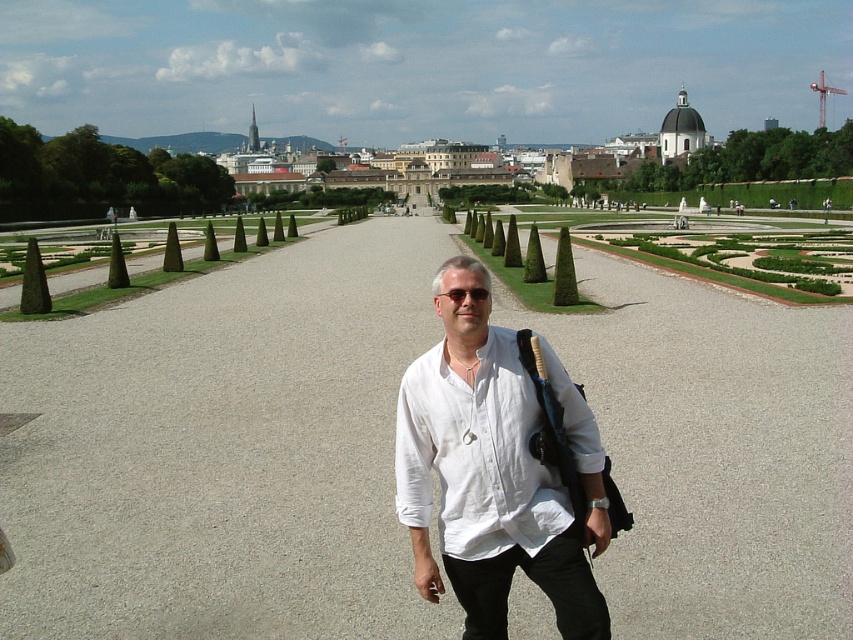
You are a tourist holding the black plastic sunglasses at center and want to walk along the gray gravel path at center. Since both are at the center, which one is closer to you?

The black plastic sunglasses at center are closer to you than the gray gravel path at center because the sunglasses are an object you are holding, while the path is the surface you are standing on.

You are standing at the entrance of the plaza and see two points marked in the image. The first point is at coordinates point (500, 445) and the second is at point (666, 122). If you want to reach the point that is closer to the grand building in the background, which coordinate should you head towards?

Point (500, 445) is in front of point (666, 122), so it is closer to the grand building in the background. Therefore, you should head towards point (500, 445).

You are standing in the plaza and want to walk from point [793,604] to point [276,209]. Which direction should you face to move towards the second point?

You should face towards the background of the plaza because point [276,209] is further away from the viewer compared to point [793,604].